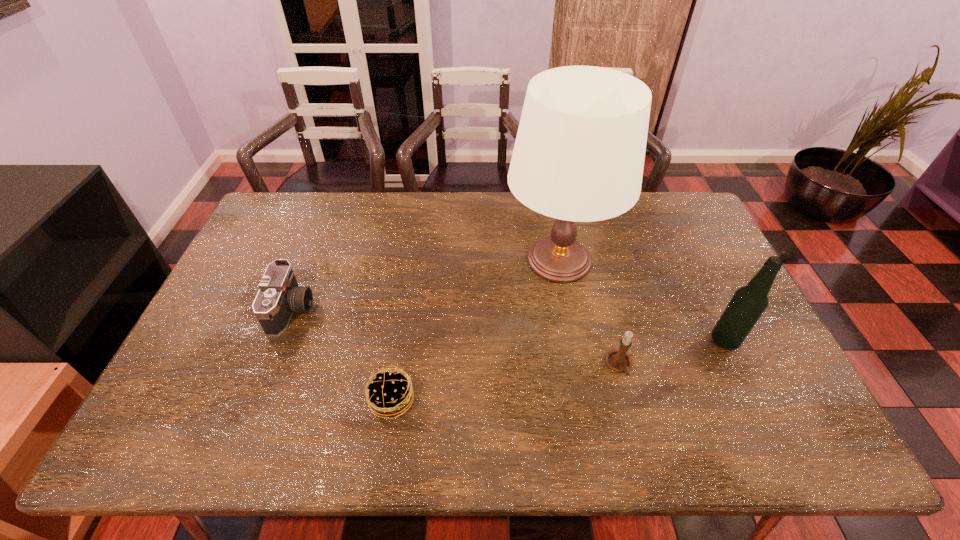
This screenshot has width=960, height=540. I want to click on free space located 0.160m on the side of the candle holder with the handle, so click(x=638, y=443).

This screenshot has height=540, width=960. In order to click on free point located 0.290m on the front-facing side of the second shortest object in this screenshot , I will do `click(413, 309)`.

The width and height of the screenshot is (960, 540). I want to click on vacant area located on the right of the second object from left to right, so click(x=447, y=400).

The image size is (960, 540). I want to click on object situated at the far edge, so click(579, 154).

Where is `object situated at the near edge`? The image size is (960, 540). object situated at the near edge is located at coordinates (388, 393).

The width and height of the screenshot is (960, 540). Identify the location of object that is positioned at the right edge. (749, 302).

In the image, there is a desktop. Find the location of `free region at the far edge`. free region at the far edge is located at coordinates (471, 219).

Locate an element on the screen. free location at the near edge is located at coordinates (224, 455).

Where is `free space at the right edge`? Image resolution: width=960 pixels, height=540 pixels. free space at the right edge is located at coordinates click(x=759, y=347).

Where is `blank space at the far right corner of the desktop`? blank space at the far right corner of the desktop is located at coordinates (675, 202).